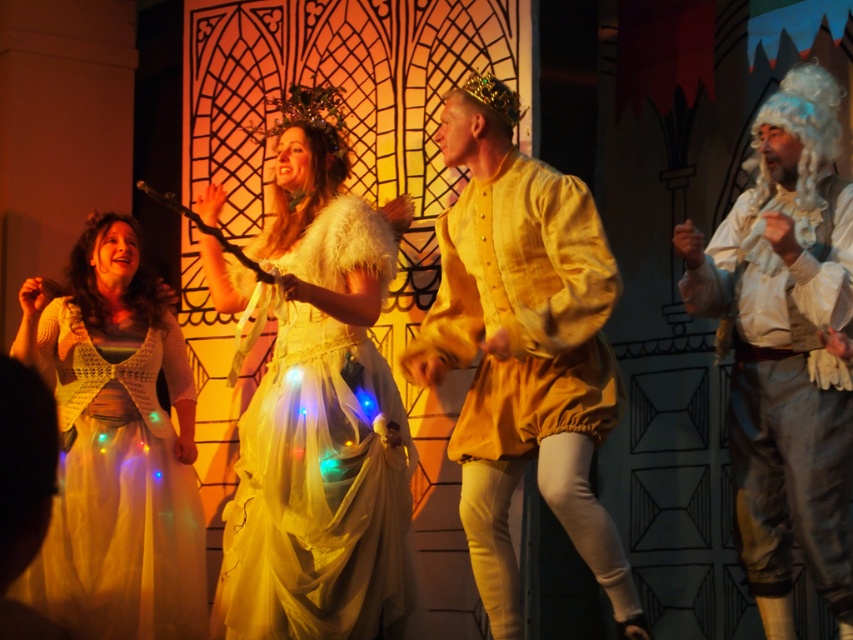
Question: Can you confirm if ivory satin dress at center is thinner than matte yellow fabric shirt at center?

Choices:
 (A) no
 (B) yes

Answer: (B)

Question: Does matte yellow fabric shirt at center appear over white satin wig at right?

Choices:
 (A) yes
 (B) no

Answer: (B)

Question: Which of these objects is positioned closest to the matte yellow fabric shirt at center?

Choices:
 (A) white lace dress at left
 (B) ivory satin dress at center
 (C) white satin wig at right

Answer: (B)

Question: Does ivory satin dress at center appear on the left side of white satin wig at right?

Choices:
 (A) no
 (B) yes

Answer: (B)

Question: Which of the following is the farthest from the observer?

Choices:
 (A) white satin wig at right
 (B) white lace dress at left
 (C) matte yellow fabric shirt at center
 (D) ivory satin dress at center

Answer: (B)

Question: Among these objects, which one is nearest to the camera?

Choices:
 (A) white satin wig at right
 (B) white lace dress at left
 (C) matte yellow fabric shirt at center
 (D) ivory satin dress at center

Answer: (C)